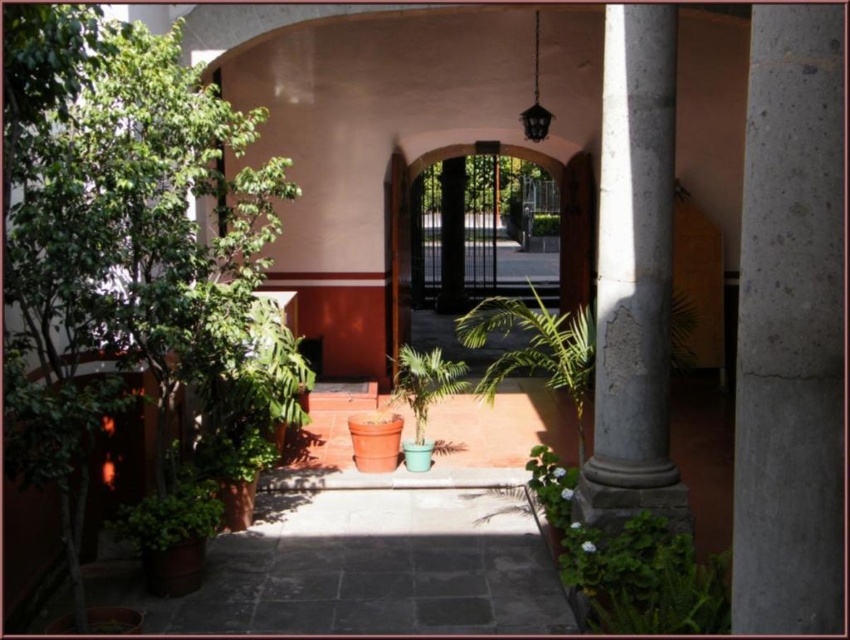
Does gray concrete pillar at center have a greater width compared to green matte plant at center?

No.

Is gray concrete pillar at center to the left of green matte plant at center from the viewer's perspective?

In fact, gray concrete pillar at center is to the right of green matte plant at center.

I want to click on gray concrete pillar at center, so click(x=790, y=326).

Where is `gray concrete pillar at center`? The image size is (850, 640). gray concrete pillar at center is located at coordinates (790, 326).

Is point (649, 45) closer to camera compared to point (423, 364)?

That is True.

You are a GUI agent. You are given a task and a screenshot of the screen. Output one action in this format:
    pyautogui.click(x=<x>, y=<y>)
    Task: Click on the smooth concrete pillar at center
    
    Given the screenshot: What is the action you would take?
    pyautogui.click(x=633, y=276)

Which is in front, point (667, 458) or point (455, 384)?

Positioned in front is point (667, 458).

This screenshot has height=640, width=850. What are the coordinates of `smooth concrete pillar at center` in the screenshot? It's located at click(x=633, y=276).

Who is taller, gray concrete pillar at center or green leafy plant at center?

green leafy plant at center is taller.

Consider the image. Who is higher up, gray concrete pillar at center or green leafy plant at center?

Positioned higher is gray concrete pillar at center.

Is point (762, 212) positioned after point (576, 368)?

That is False.

Find the location of a particular element. Image resolution: width=850 pixels, height=640 pixels. gray concrete pillar at center is located at coordinates (790, 326).